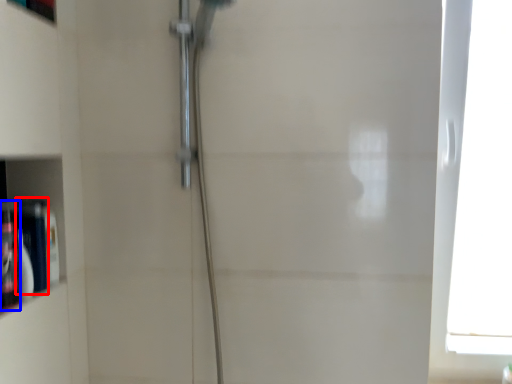
Question: Among these objects, which one is nearest to the camera, toiletry (highlighted by a red box) or toiletry (highlighted by a blue box)?

Choices:
 (A) toiletry
 (B) toiletry

Answer: (B)